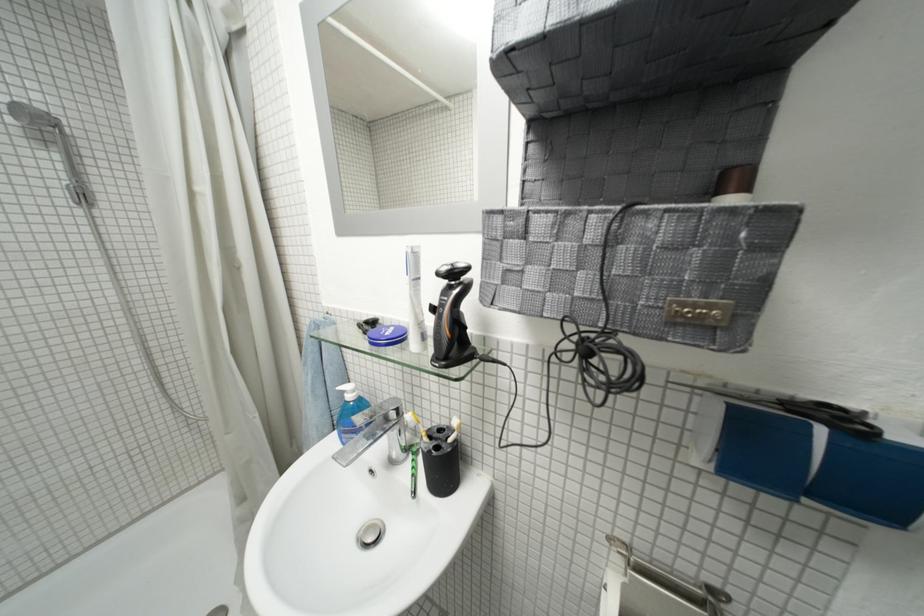
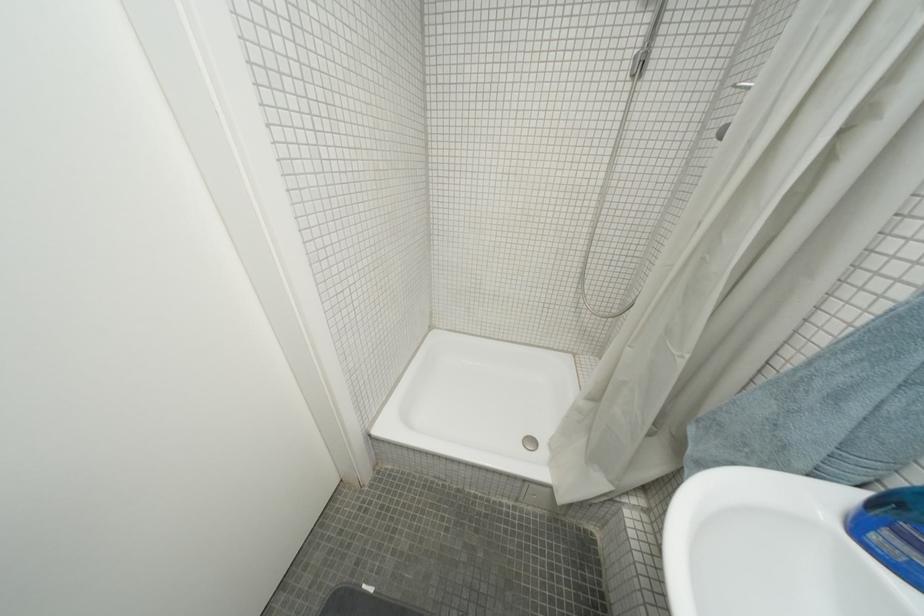
The images are taken continuously from a first-person perspective. In which direction is your viewpoint rotating?

The camera's rotation is toward left-down.